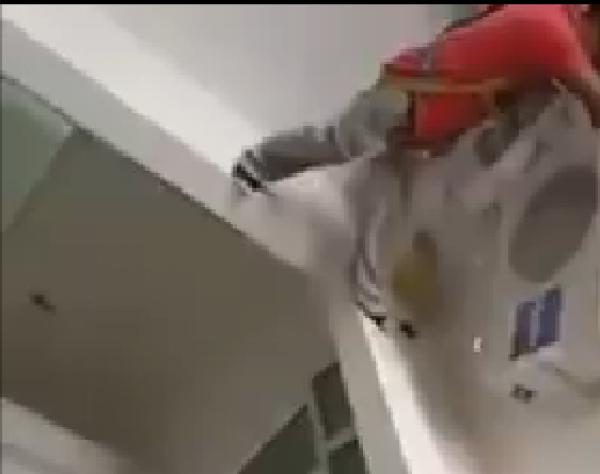
The height and width of the screenshot is (474, 600). I want to click on blue washing machine components, so click(x=552, y=319), click(x=525, y=330).